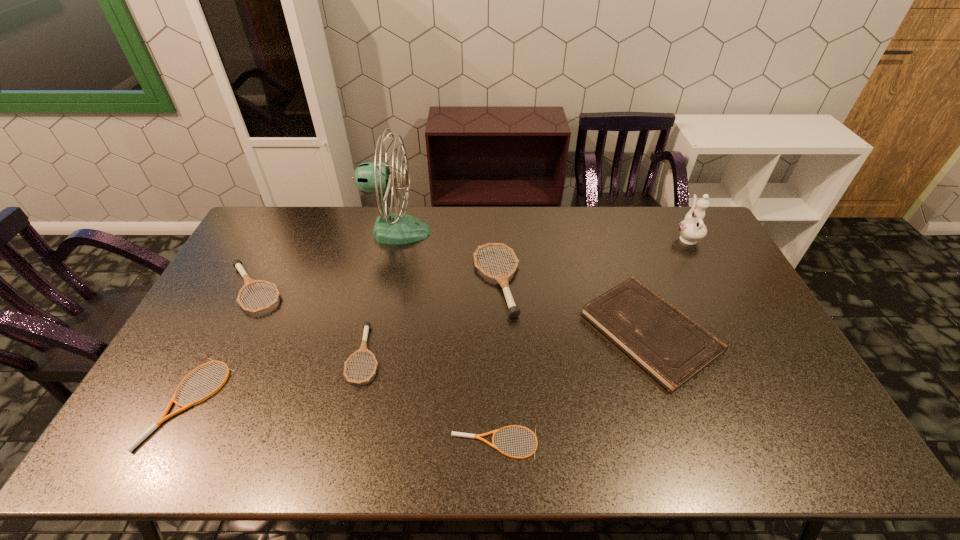
At what (x,y) coordinates should I click in order to perform the action: click on the second gray tennis racket from left to right. Please return your answer as a coordinate pair (x, y). Looking at the image, I should click on (363, 348).

The image size is (960, 540). I want to click on the bigger beige tennis racket, so click(163, 417).

Where is `the left beige tennis racket`? The width and height of the screenshot is (960, 540). the left beige tennis racket is located at coordinates (163, 417).

The height and width of the screenshot is (540, 960). Find the location of `the right beige tennis racket`. the right beige tennis racket is located at coordinates (459, 434).

Image resolution: width=960 pixels, height=540 pixels. I want to click on the shortest tennis racket, so click(459, 434).

Identify the location of vacant region located in front of the fan, directing airflow. (527, 232).

The height and width of the screenshot is (540, 960). I want to click on free space located 0.310m on the left of the biggest gray tennis racket, so click(x=378, y=281).

The width and height of the screenshot is (960, 540). In order to click on vacant space located 0.360m on the back of the paperback book in this screenshot , I will do `click(610, 217)`.

Identify the location of free space located 0.070m on the back of the fourth shortest tennis racket. This screenshot has width=960, height=540. (274, 251).

Where is `vacant space located on the left of the third tennis racket from left to right`? The image size is (960, 540). vacant space located on the left of the third tennis racket from left to right is located at coordinates (309, 354).